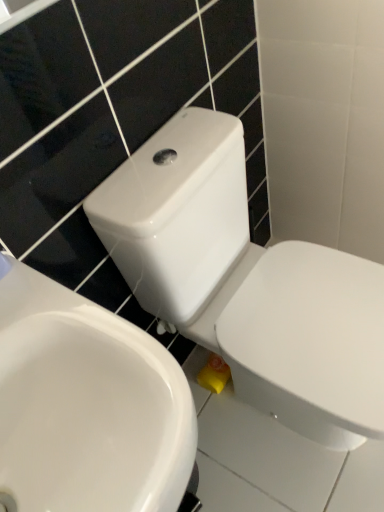
The height and width of the screenshot is (512, 384). I want to click on white glossy toilet at center, so click(x=246, y=282).

Describe the element at coordinates (246, 282) in the screenshot. The image size is (384, 512). I see `white glossy toilet at center` at that location.

Measure the distance between white glossy sink at center and camera.

white glossy sink at center is 16.67 inches from camera.

The width and height of the screenshot is (384, 512). Describe the element at coordinates (86, 405) in the screenshot. I see `white glossy sink at center` at that location.

Identify the location of white glossy sink at center. (86, 405).

Identify the location of white glossy toilet at center. (246, 282).

Considering the relative positions of white glossy sink at center and white glossy toilet at center in the image provided, is white glossy sink at center to the left of white glossy toilet at center from the viewer's perspective?

Indeed, white glossy sink at center is positioned on the left side of white glossy toilet at center.

Does white glossy sink at center lie in front of white glossy toilet at center?

Yes, white glossy sink at center is in front of white glossy toilet at center.

Is point (0, 456) closer to viewer compared to point (223, 204)?

That is True.

From the image's perspective, between white glossy sink at center and white glossy toilet at center, which one is located above?

From the image's view, white glossy toilet at center is above.

Looking at this image, from a real-world perspective, is white glossy sink at center positioned above or below white glossy toilet at center?

white glossy sink at center is above white glossy toilet at center.

In the scene shown: Looking at their sizes, would you say white glossy sink at center is wider or thinner than white glossy toilet at center?

white glossy sink at center is thinner than white glossy toilet at center.

Based on the photo, in terms of height, does white glossy sink at center look taller or shorter compared to white glossy toilet at center?

In the image, white glossy sink at center appears to be shorter than white glossy toilet at center.

In terms of size, does white glossy sink at center appear bigger or smaller than white glossy toilet at center?

Considering their sizes, white glossy sink at center takes up less space than white glossy toilet at center.

Is white glossy sink at center completely or partially outside of white glossy toilet at center?

Yes, white glossy sink at center is outside of white glossy toilet at center.

Is white glossy sink at center next to white glossy toilet at center and touching it?

No, white glossy sink at center is not making contact with white glossy toilet at center.

Is white glossy sink at center aimed at white glossy toilet at center?

No, white glossy sink at center is not facing towards white glossy toilet at center.

Consider the image. How far apart are white glossy sink at center and white glossy toilet at center?

white glossy sink at center and white glossy toilet at center are 13.74 inches apart.

This screenshot has width=384, height=512. Find the location of `toilet located above the white glossy sink at center (from the image's perspective)`. toilet located above the white glossy sink at center (from the image's perspective) is located at coordinates (246, 282).

Which is more to the left, white glossy toilet at center or white glossy sink at center?

white glossy sink at center.

Does white glossy toilet at center lie in front of white glossy sink at center?

No, white glossy toilet at center is further to the viewer.

Does point (103, 224) appear closer or farther from the camera than point (163, 440)?

Point (103, 224).

From the image's perspective, is white glossy toilet at center located above white glossy sink at center?

Yes, from the image's perspective, white glossy toilet at center is over white glossy sink at center.

From a real-world perspective, which object stands above the other?

From a 3D spatial view, white glossy sink at center is above.

In the scene shown: Is white glossy toilet at center wider than white glossy sink at center?

Indeed, white glossy toilet at center has a greater width compared to white glossy sink at center.

In terms of height, does white glossy toilet at center look taller or shorter compared to white glossy sink at center?

In the image, white glossy toilet at center appears to be taller than white glossy sink at center.

In terms of size, does white glossy toilet at center appear bigger or smaller than white glossy sink at center?

Considering their sizes, white glossy toilet at center takes up more space than white glossy sink at center.

Is white glossy sink at center inside white glossy toilet at center?

No, white glossy toilet at center does not contain white glossy sink at center.

Would you say white glossy toilet at center is a long distance from white glossy sink at center?

No, white glossy toilet at center is not far from white glossy sink at center.

Is white glossy toilet at center facing away from white glossy sink at center?

That's not correct — white glossy toilet at center is not looking away from white glossy sink at center.

In the scene shown: Can you tell me how much white glossy toilet at center and white glossy sink at center differ in facing direction?

The angular difference between white glossy toilet at center and white glossy sink at center is 0.576 degrees.

At what (x,y) coordinates should I click in order to perform the action: click on toilet that is under the white glossy sink at center (from a real-world perspective). Please return your answer as a coordinate pair (x, y). The image size is (384, 512). Looking at the image, I should click on (246, 282).

This screenshot has height=512, width=384. Find the location of `sink above the white glossy toilet at center (from a real-world perspective)`. sink above the white glossy toilet at center (from a real-world perspective) is located at coordinates (86, 405).

Locate an element on the screen. toilet directly beneath the white glossy sink at center (from a real-world perspective) is located at coordinates (246, 282).